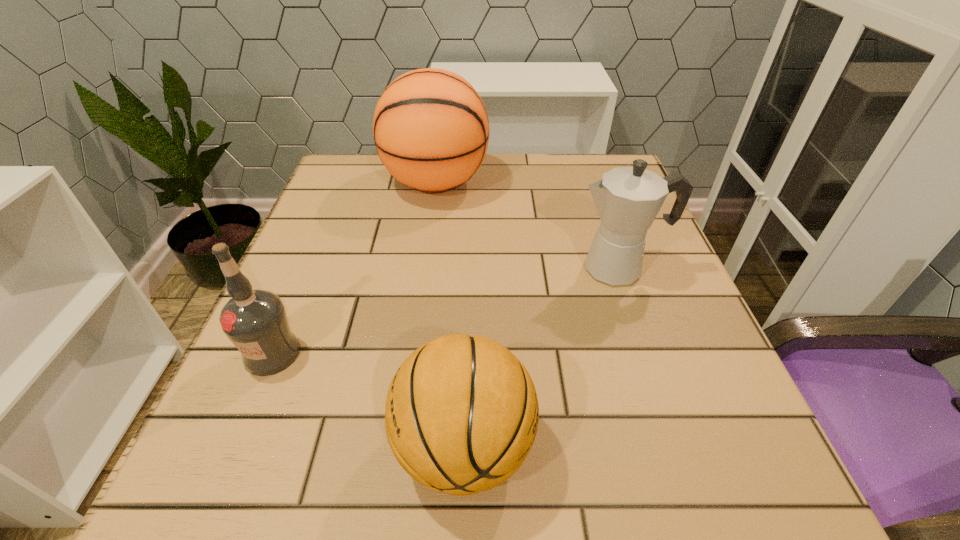
Find the location of a particular element. This screenshot has width=960, height=540. vacant space located 0.090m on the front label of the leftmost object is located at coordinates (239, 433).

Image resolution: width=960 pixels, height=540 pixels. I want to click on vacant region located on the surface of the nearer basketball near the brand logo, so coord(614,447).

At what (x,y) coordinates should I click in order to perform the action: click on object positioned at the far edge. Please return your answer as a coordinate pair (x, y). Looking at the image, I should click on (431, 130).

Locate an element on the screen. object at the near edge is located at coordinates (461, 415).

Image resolution: width=960 pixels, height=540 pixels. In order to click on basketball that is positioned at the left edge in this screenshot , I will do `click(431, 130)`.

This screenshot has width=960, height=540. Find the location of `vodka located at the left edge`. vodka located at the left edge is located at coordinates (255, 321).

Where is `object situated at the right edge`? This screenshot has height=540, width=960. object situated at the right edge is located at coordinates (627, 199).

At what (x,y) coordinates should I click in order to perform the action: click on object positioned at the far left corner. Please return your answer as a coordinate pair (x, y). The width and height of the screenshot is (960, 540). Looking at the image, I should click on (431, 130).

You are a GUI agent. You are given a task and a screenshot of the screen. Output one action in this format:
    pyautogui.click(x=<x>, y=<y>)
    Task: Click on the free location at the far edge
    This screenshot has height=540, width=960.
    Given the screenshot: What is the action you would take?
    pyautogui.click(x=524, y=190)

Identify the location of blank space at the near edge. (623, 495).